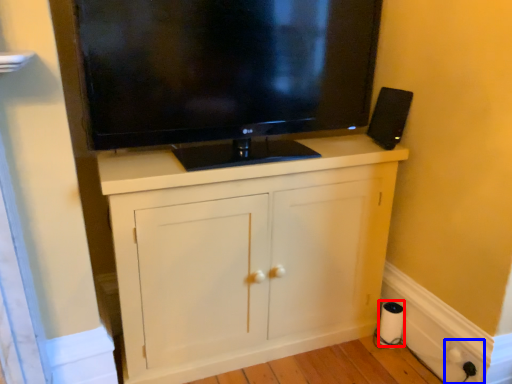
Question: Which object is further to the camera taking this photo, paper towel (highlighted by a red box) or electric outlet (highlighted by a blue box)?

Choices:
 (A) paper towel
 (B) electric outlet

Answer: (A)